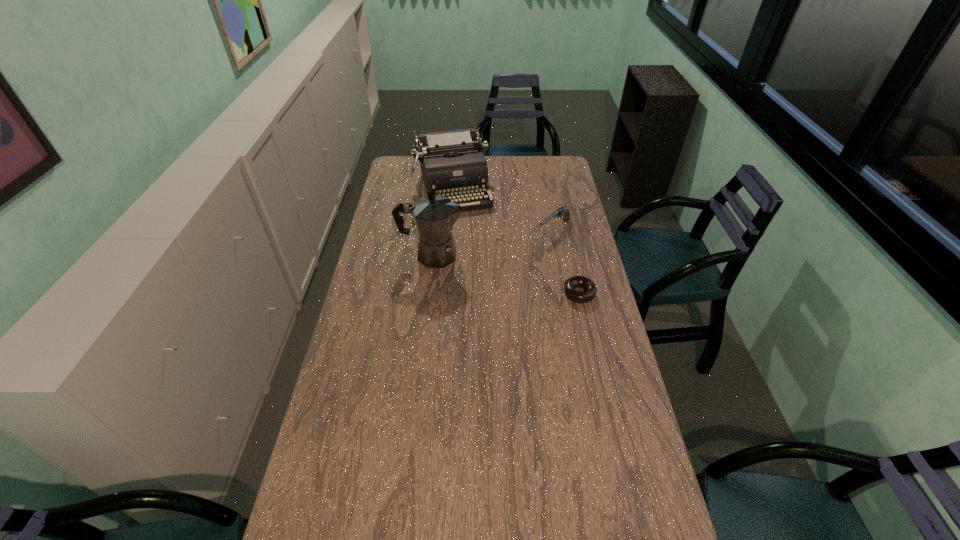
Locate an element on the screen. free point located aiming along the barrel of the gun is located at coordinates (521, 254).

You are a GUI agent. You are given a task and a screenshot of the screen. Output one action in this format:
    pyautogui.click(x=<x>, y=<y>)
    Task: Click on the blank space located on the front-facing side of the second tallest object
    
    Given the screenshot: What is the action you would take?
    pyautogui.click(x=469, y=240)

You are a GUI agent. You are given a task and a screenshot of the screen. Output one action in this format:
    pyautogui.click(x=<x>, y=<y>)
    Task: Click on the free space located 0.200m on the front-facing side of the second tallest object
    
    Given the screenshot: What is the action you would take?
    pyautogui.click(x=470, y=245)

At what (x,y) coordinates should I click in order to perform the action: click on free region located 0.400m on the front-facing side of the second tallest object. Please return your answer as a coordinate pair (x, y). The width and height of the screenshot is (960, 540). Looking at the image, I should click on (482, 277).

Where is `object that is at the far edge`? This screenshot has height=540, width=960. object that is at the far edge is located at coordinates (452, 162).

Where is `coffeepot that is positioned at the left edge`? The image size is (960, 540). coffeepot that is positioned at the left edge is located at coordinates (434, 216).

I want to click on typewriter located at the left edge, so click(x=452, y=162).

This screenshot has height=540, width=960. I want to click on doughnut that is at the right edge, so click(574, 295).

Locate an element on the screen. gun at the right edge is located at coordinates (561, 211).

Locate an element on the screen. object situated at the far left corner is located at coordinates (452, 162).